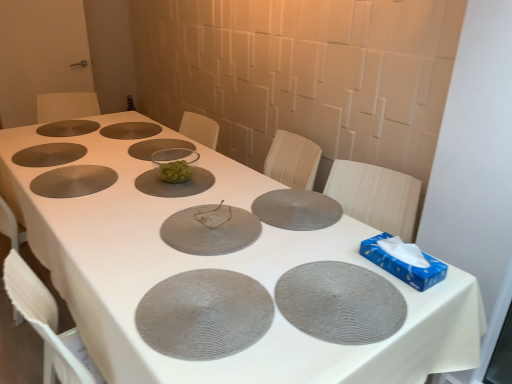
Locate an element on the screen. free spot to the left of matte gray glass plate at center, which ranks as the eighth glass plate in back-to-front order is located at coordinates coord(120,221).